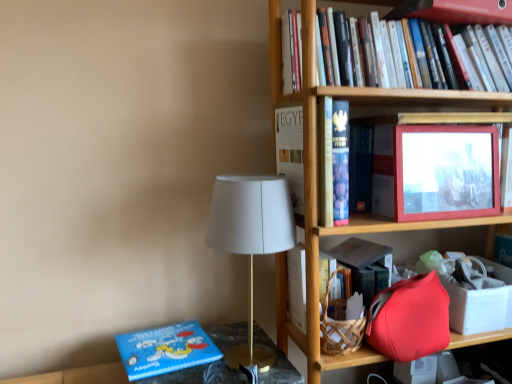
You are a GUI agent. You are given a task and a screenshot of the screen. Output one action in this format:
    pyautogui.click(x=<x>, y=<y>)
    Task: Click on the blank space situated above white matte box at right (from a real-world perspective)
    This screenshot has width=512, height=384.
    Given the screenshot: What is the action you would take?
    pyautogui.click(x=471, y=270)